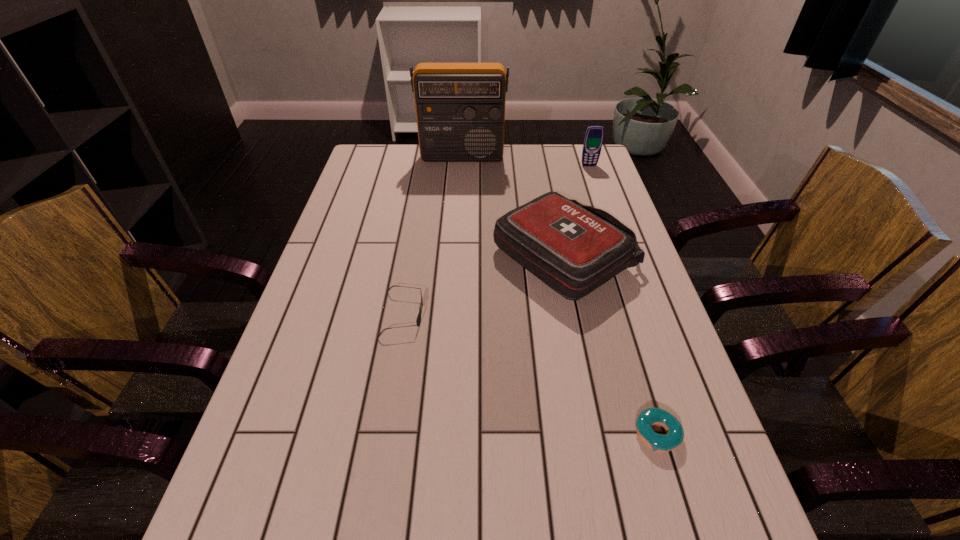
You are a GUI agent. You are given a task and a screenshot of the screen. Output one action in this format:
    pyautogui.click(x=<x>, y=<y>)
    Task: Click on the radio receiver
    This screenshot has width=960, height=540.
    Given the screenshot: What is the action you would take?
    pyautogui.click(x=460, y=107)

Locate an element on the screen. This screenshot has width=960, height=540. the second tallest object is located at coordinates (594, 135).

Where is `the third tallest object`? the third tallest object is located at coordinates (574, 249).

Identify the location of the fourth tallest object. (418, 321).

This screenshot has width=960, height=540. Identify the location of doughnut. (651, 416).

Find the location of a particular element. The image size is (960, 540). the nearest object is located at coordinates (651, 416).

Find the location of a particular element. free space located 0.160m on the front-facing side of the tallest object is located at coordinates (460, 191).

Find the location of a particular element. free region located 0.360m on the front-facing side of the second tallest object is located at coordinates (611, 229).

The image size is (960, 540). I want to click on vacant space located on the left of the first-aid kit, so click(446, 258).

I want to click on free space located on the lenses of the second shortest object, so click(580, 314).